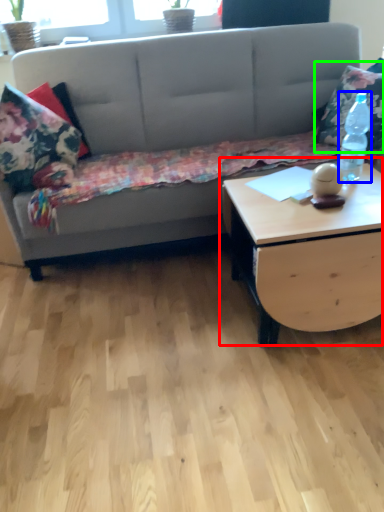
Question: Which object is positioned farthest from coffee table (highlighted by a red box)? Select from bottle (highlighted by a blue box) and throw pillow (highlighted by a green box).

Choices:
 (A) bottle
 (B) throw pillow

Answer: (B)